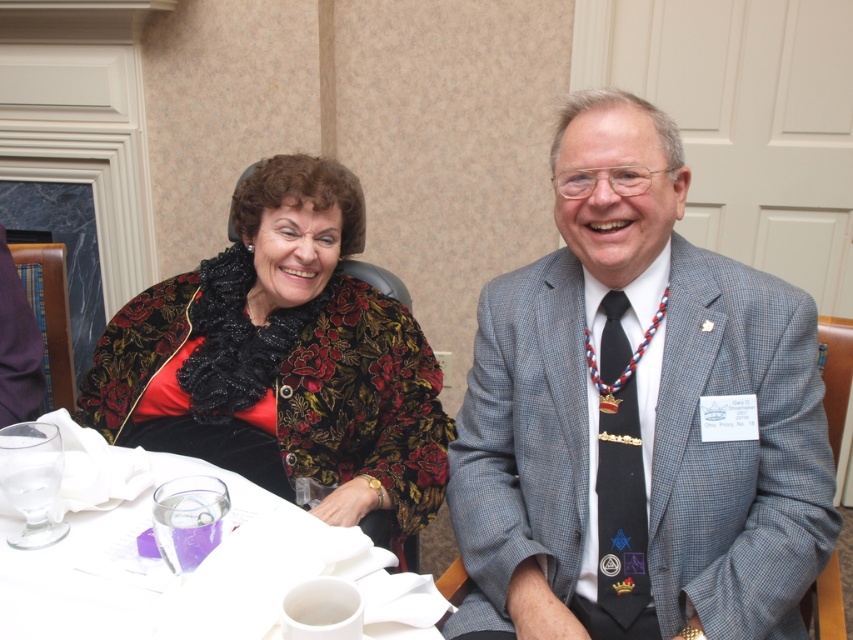
Question: Is gray checkered suit at center thinner than floral velvet jacket at upper left?

Choices:
 (A) no
 (B) yes

Answer: (B)

Question: Does gray checkered suit at center have a smaller size compared to floral velvet jacket at upper left?

Choices:
 (A) no
 (B) yes

Answer: (B)

Question: Does gray checkered suit at center have a larger size compared to white paper napkin at lower left?

Choices:
 (A) no
 (B) yes

Answer: (B)

Question: Among these objects, which one is nearest to the camera?

Choices:
 (A) white paper napkin at lower left
 (B) floral velvet jacket at upper left
 (C) gray checkered suit at center

Answer: (A)

Question: Which object is the farthest from the white paper napkin at lower left?

Choices:
 (A) gray checkered suit at center
 (B) floral velvet jacket at upper left

Answer: (A)

Question: Which point appears farthest from the camera in this image?

Choices:
 (A) (259, 506)
 (B) (643, 339)

Answer: (A)